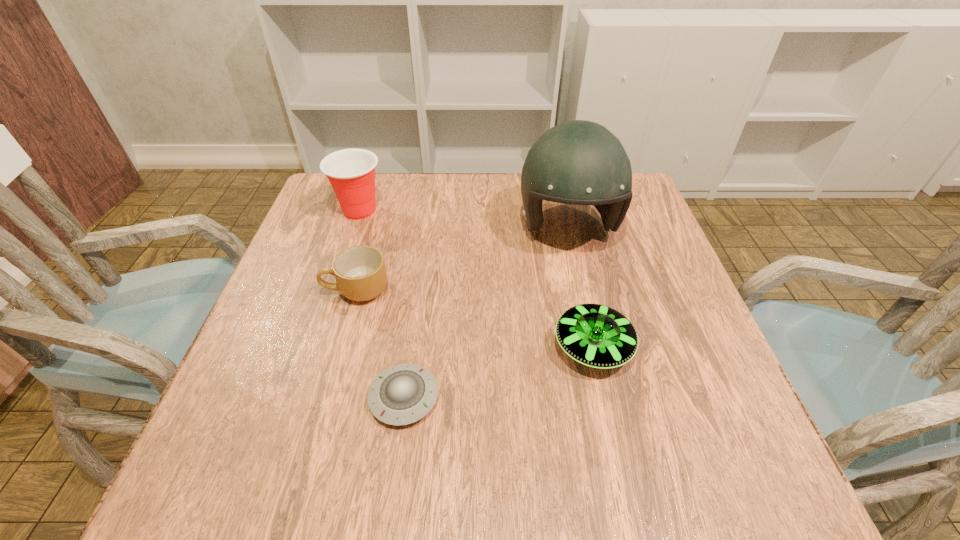
This screenshot has width=960, height=540. I want to click on vacant space located on the back of the shorter saucer, so click(422, 262).

Image resolution: width=960 pixels, height=540 pixels. I want to click on football helmet present at the far edge, so click(x=578, y=162).

At what (x,y) coordinates should I click in order to perform the action: click on cup at the far edge. Please return your answer as a coordinate pair (x, y). Looking at the image, I should click on (x=351, y=172).

Find the location of a particular element. This screenshot has width=960, height=540. cup present at the left edge is located at coordinates (351, 172).

This screenshot has width=960, height=540. What are the coordinates of `mug at the left edge` in the screenshot? It's located at (360, 272).

What are the coordinates of `football helmet situated at the right edge` in the screenshot? It's located at coord(578,162).

Identify the location of saucer that is at the right edge. (595, 335).

At what (x,y) coordinates should I click in order to perform the action: click on object located in the far left corner section of the desktop. Please return your answer as a coordinate pair (x, y). This screenshot has width=960, height=540. Looking at the image, I should click on click(x=351, y=172).

The image size is (960, 540). Identify the location of object situated at the far right corner. (578, 162).

Where is `vacant space at the far edge of the desktop`? The height and width of the screenshot is (540, 960). vacant space at the far edge of the desktop is located at coordinates (487, 188).